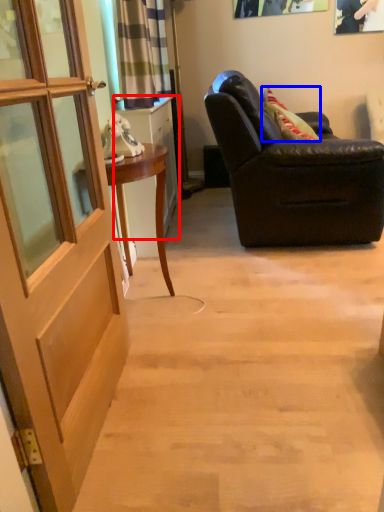
Question: Which object appears farthest to the camera in this image, cabinetry (highlighted by a red box) or pillow (highlighted by a blue box)?

Choices:
 (A) cabinetry
 (B) pillow

Answer: (B)